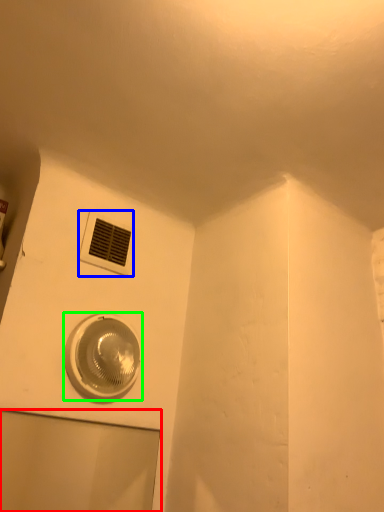
Question: Estimate the real-world distances between objects in this image. Which object is closer to glass door (highlighted by a red box), air conditioning (highlighted by a blue box) or home appliance (highlighted by a green box)?

Choices:
 (A) air conditioning
 (B) home appliance

Answer: (B)